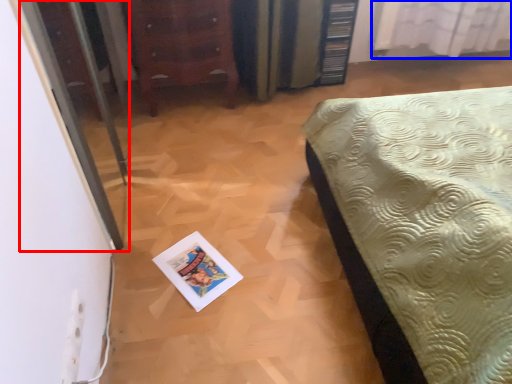
Question: Which object is further to the camera taking this photo, screen door (highlighted by a red box) or curtain (highlighted by a blue box)?

Choices:
 (A) screen door
 (B) curtain

Answer: (B)